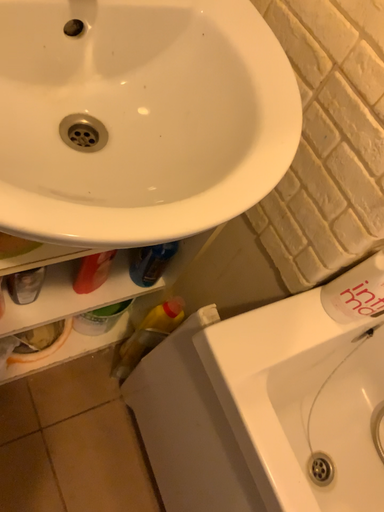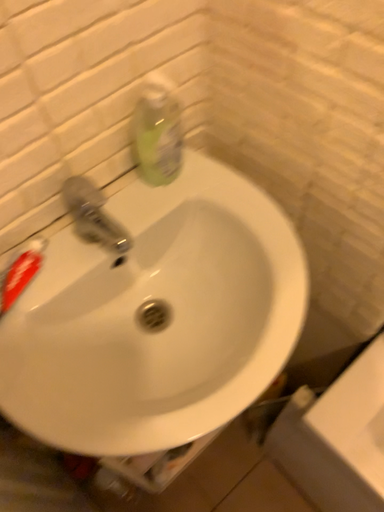
Question: Which way did the camera rotate in the video?

Choices:
 (A) rotated left
 (B) rotated right

Answer: (A)